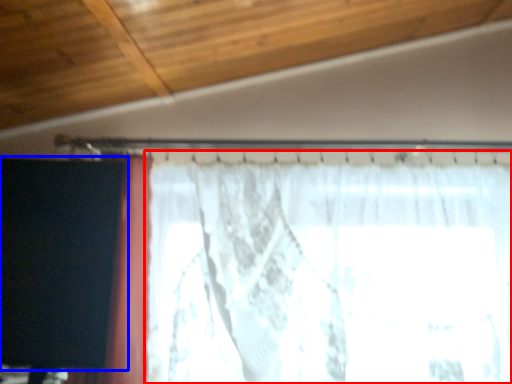
Question: Which object is closer to the camera taking this photo, curtain (highlighted by a red box) or curtain (highlighted by a blue box)?

Choices:
 (A) curtain
 (B) curtain

Answer: (B)